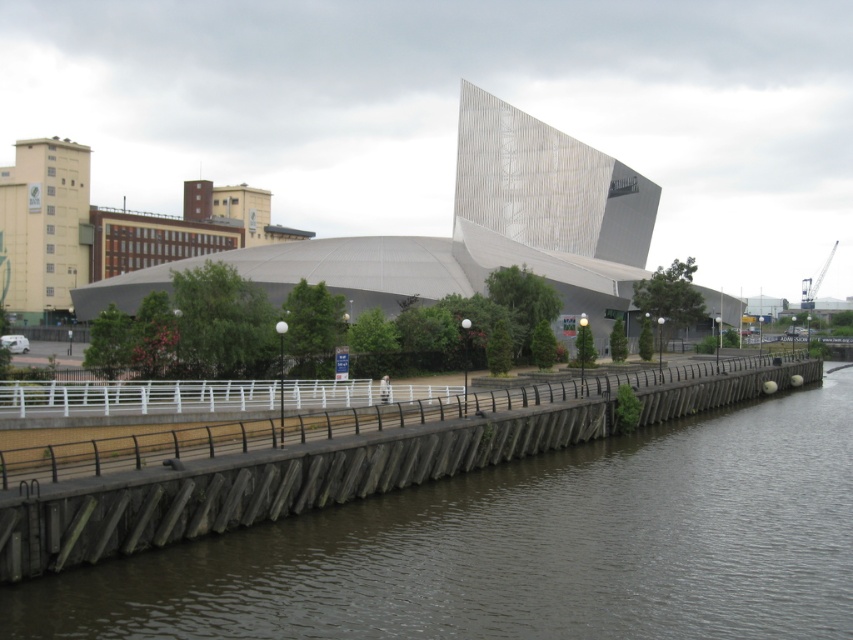
Can you confirm if brown concrete river at lower left is positioned below white concrete bridge at center?

Yes, brown concrete river at lower left is below white concrete bridge at center.

Between brown concrete river at lower left and white concrete bridge at center, which one has more height?

white concrete bridge at center

Locate an element on the screen. This screenshot has width=853, height=640. brown concrete river at lower left is located at coordinates (523, 547).